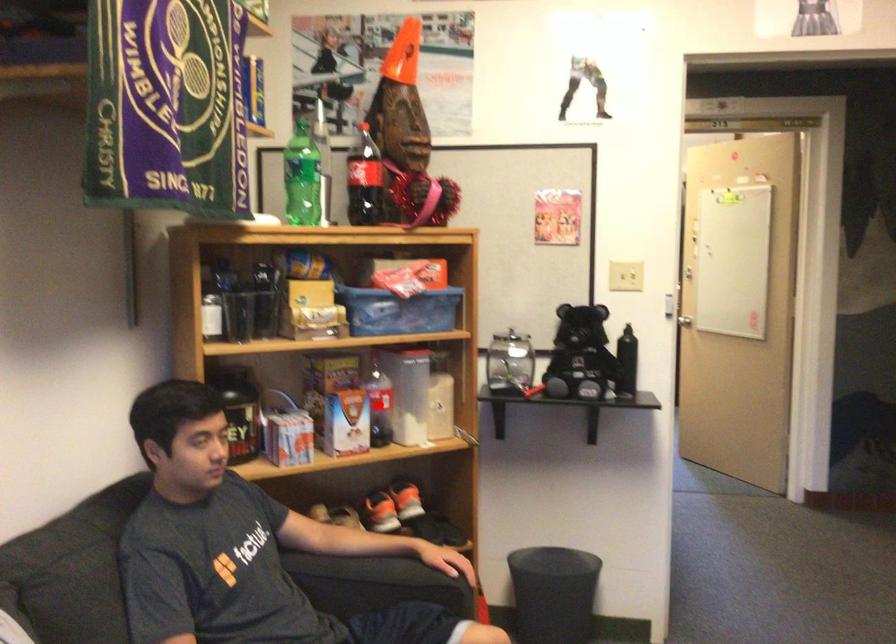
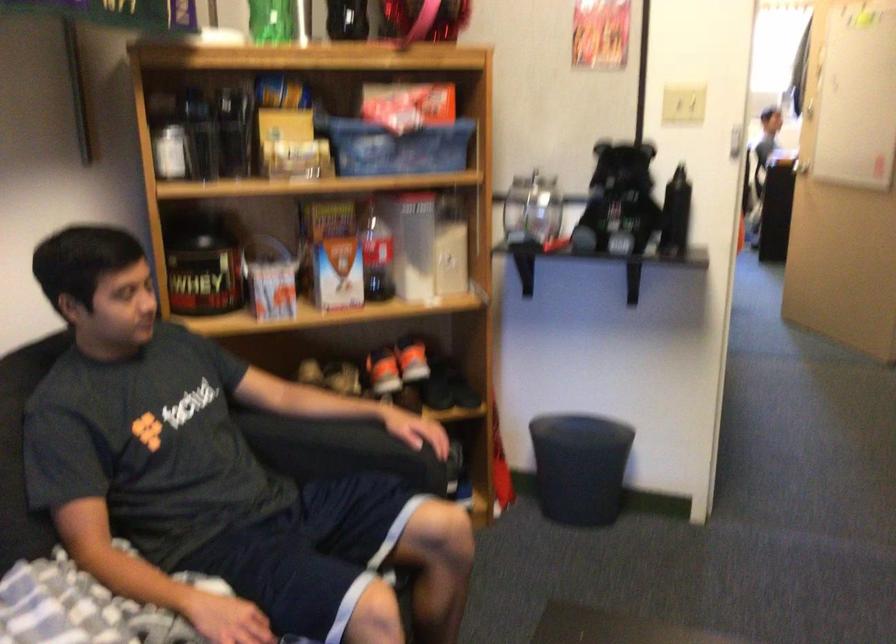
Where in the second image is the point corresponding to the highlighted location from the first image?

(375, 254)